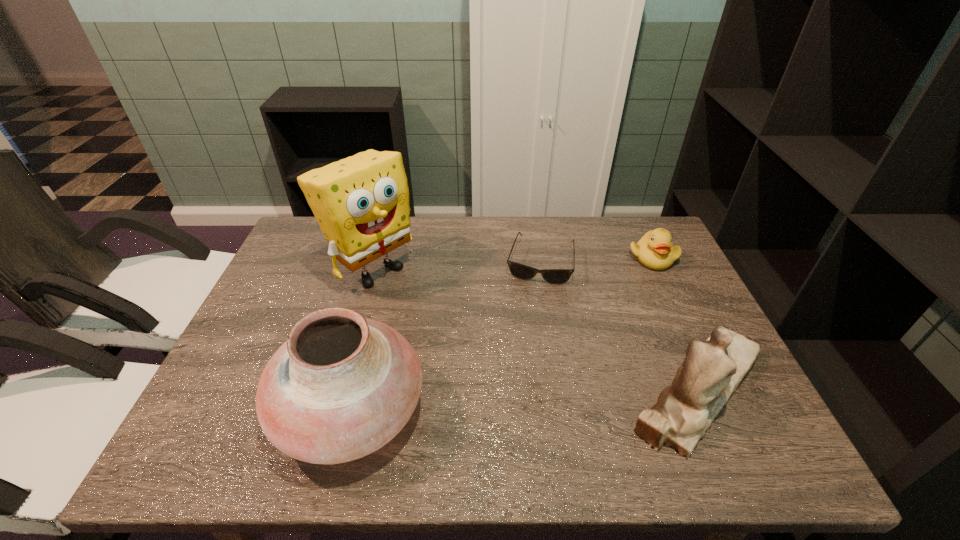
The width and height of the screenshot is (960, 540). In order to click on vacant area between the sponge and the third object from right to left in this screenshot , I will do `click(456, 265)`.

Where is `vacant space in between the third object from right to left and the fourth shortest object`? The width and height of the screenshot is (960, 540). vacant space in between the third object from right to left and the fourth shortest object is located at coordinates (445, 336).

Locate an element on the screen. object that stands as the third closest to the duckling is located at coordinates (361, 203).

Point out which object is positioned as the second nearest to the figurine. Please provide its 2D coordinates. Your answer should be formatted as a tuple, i.e. [(x, y)], where the tuple contains the x and y coordinates of a point satisfying the conditions above.

[(654, 250)]

The height and width of the screenshot is (540, 960). In order to click on vacant space that satisfies the following two spatial constraints: 1. on the front side of the sunglasses; 2. on the front-facing side of the third tallest object in this screenshot , I will do `click(561, 390)`.